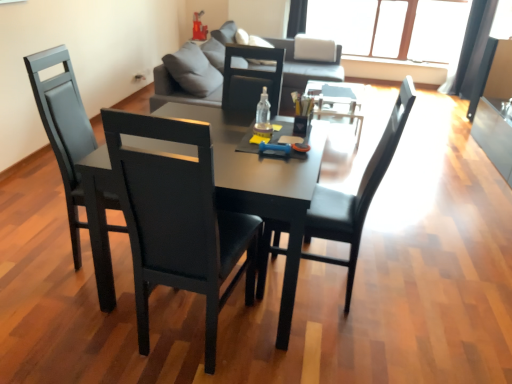
Question: Does black leather chair at left, which is the 2th chair from left to right, have a greater width compared to black leather chair at center, the third chair from the left?

Choices:
 (A) no
 (B) yes

Answer: (A)

Question: Considering the relative sizes of black leather chair at left, which is the second chair from right to left, and black leather chair at center, the 1th chair from the right, in the image provided, is black leather chair at left, which is the second chair from right to left, bigger than black leather chair at center, the 1th chair from the right,?

Choices:
 (A) no
 (B) yes

Answer: (B)

Question: Is black leather chair at left, which is the second chair from right to left, far from black leather chair at center, the 1th chair from the right?

Choices:
 (A) no
 (B) yes

Answer: (A)

Question: Considering the relative sizes of black leather chair at left, which is the 2th chair from left to right, and black leather chair at center, the 1th chair from the right, in the image provided, is black leather chair at left, which is the 2th chair from left to right, thinner than black leather chair at center, the 1th chair from the right,?

Choices:
 (A) no
 (B) yes

Answer: (B)

Question: Does black leather chair at left, which is the 2th chair from left to right, appear on the left side of black leather chair at center, the 1th chair from the right?

Choices:
 (A) no
 (B) yes

Answer: (B)

Question: Considering their positions, is transparent glass window at upper center located in front of or behind black leather chair at center, the third chair from the left?

Choices:
 (A) behind
 (B) front

Answer: (A)

Question: From their relative heights in the image, would you say transparent glass window at upper center is taller or shorter than black leather chair at center, the 1th chair from the right?

Choices:
 (A) tall
 (B) short

Answer: (B)

Question: Considering the relative positions of transparent glass window at upper center and black leather chair at center, the 1th chair from the right, in the image provided, is transparent glass window at upper center to the left or to the right of black leather chair at center, the 1th chair from the right,?

Choices:
 (A) left
 (B) right

Answer: (B)

Question: Is point (409, 19) closer or farther from the camera than point (315, 228)?

Choices:
 (A) farther
 (B) closer

Answer: (A)

Question: Looking at the image, does black leather chair at center, the 1th chair from the right, seem bigger or smaller compared to transparent plastic bottle at center?

Choices:
 (A) small
 (B) big

Answer: (B)

Question: Is point (257, 296) closer or farther from the camera than point (260, 125)?

Choices:
 (A) closer
 (B) farther

Answer: (B)

Question: From a real-world perspective, relative to transparent plastic bottle at center, is black leather chair at center, the third chair from the left, vertically above or below?

Choices:
 (A) below
 (B) above

Answer: (A)

Question: Is black leather chair at center, the third chair from the left, wider or thinner than transparent plastic bottle at center?

Choices:
 (A) wide
 (B) thin

Answer: (A)

Question: Considering the relative positions of matte black table at center and black leather chair at center, the third chair from the left, in the image provided, is matte black table at center to the left or to the right of black leather chair at center, the third chair from the left,?

Choices:
 (A) right
 (B) left

Answer: (B)

Question: From the image's perspective, is matte black table at center located above or below black leather chair at center, the 1th chair from the right?

Choices:
 (A) above
 (B) below

Answer: (B)